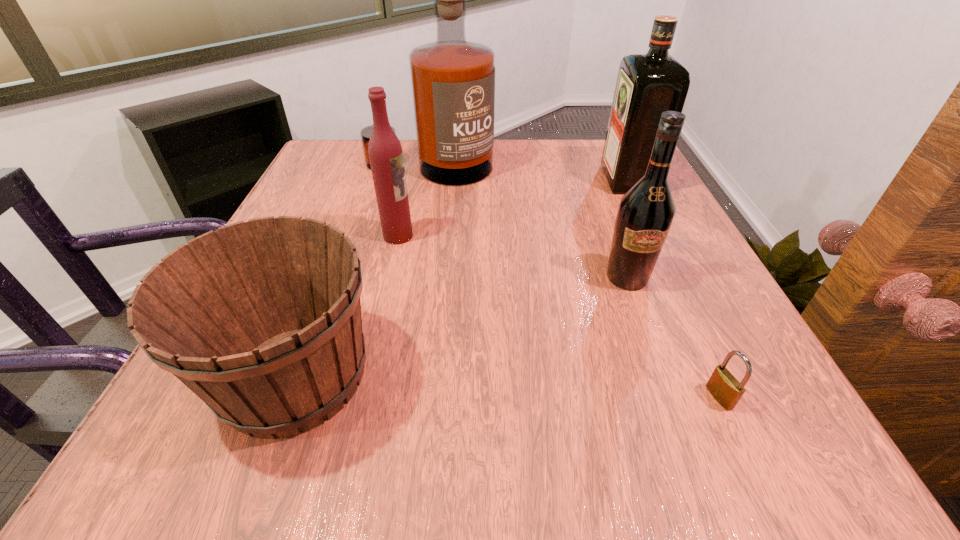
The height and width of the screenshot is (540, 960). Find the location of `vacant area at the near left corner of the desktop`. vacant area at the near left corner of the desktop is located at coordinates (257, 462).

Image resolution: width=960 pixels, height=540 pixels. I want to click on blank space at the near right corner of the desktop, so click(x=708, y=409).

The height and width of the screenshot is (540, 960). Identify the location of empty space between the shortest liquor and the fourth farthest object. (513, 256).

Image resolution: width=960 pixels, height=540 pixels. I want to click on unoccupied area between the wine bottle and the wine bucket, so click(x=461, y=326).

This screenshot has width=960, height=540. I want to click on free area in between the third nearest object and the fourth nearest object, so click(513, 256).

Locate an element on the screen. empty space between the third farthest object and the rightmost liquor is located at coordinates (513, 208).

Locate an element on the screen. The height and width of the screenshot is (540, 960). vacant area that lies between the fifth tallest object and the wine bottle is located at coordinates (461, 326).

Locate an element on the screen. This screenshot has width=960, height=540. free space between the third farthest object and the tallest object is located at coordinates (414, 202).

This screenshot has height=540, width=960. What are the coordinates of `free area in between the second tallest liquor and the wine bucket` in the screenshot? It's located at (461, 278).

The width and height of the screenshot is (960, 540). What are the coordinates of `vacant area that lies between the nearest liquor and the tallest liquor` in the screenshot? It's located at (414, 202).